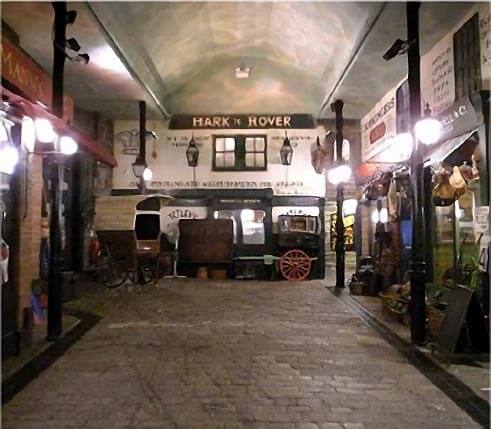
Find the location of a particular element. cluster of three lamps on left side is located at coordinates click(66, 146), click(46, 132), click(30, 134).